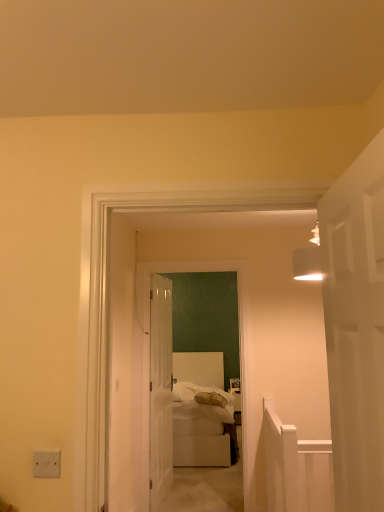
Where is `empty space that is ontop of white fabric bed at center`? This screenshot has width=384, height=512. empty space that is ontop of white fabric bed at center is located at coordinates (191, 258).